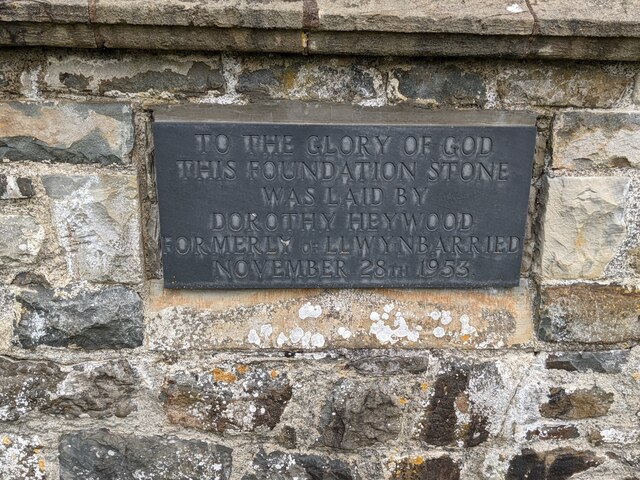
Find the location of a particular element. wall is located at coordinates (355, 470).